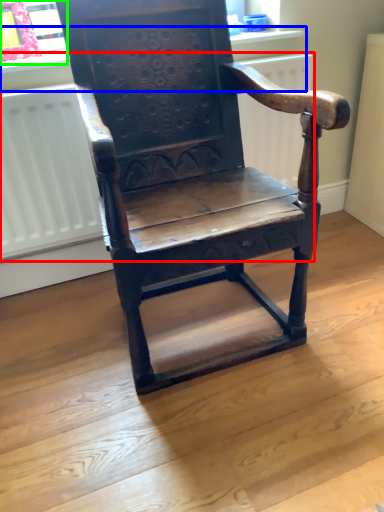
Question: Estimate the real-world distances between objects in this image. Which object is farther from radiator (highlighted by a red box), window sill (highlighted by a blue box) or window frame (highlighted by a green box)?

Choices:
 (A) window sill
 (B) window frame

Answer: (B)